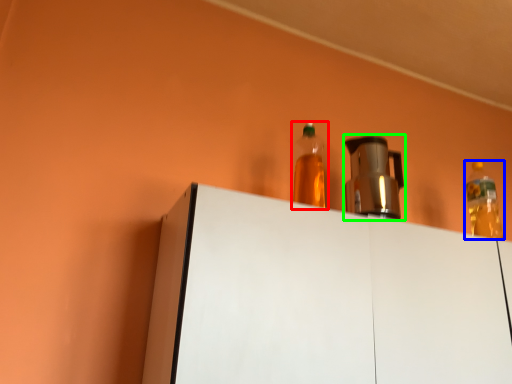
Question: Considering the real-world distances, which object is closest to bottle (highlighted by a red box)? bottle (highlighted by a blue box) or appliance (highlighted by a green box).

Choices:
 (A) bottle
 (B) appliance

Answer: (A)